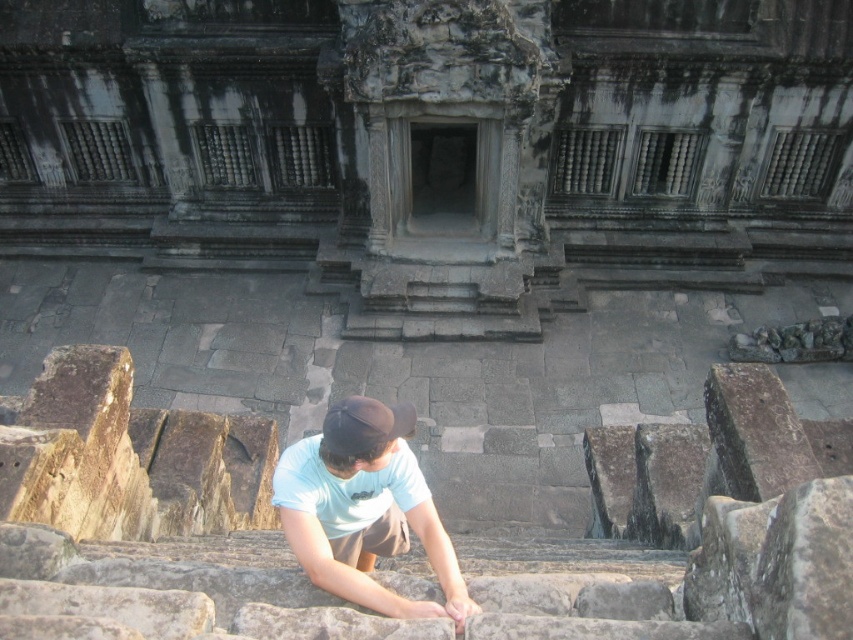
Question: Can you confirm if light blue t-shirt at center is bigger than black fabric baseball cap at center?

Choices:
 (A) no
 (B) yes

Answer: (B)

Question: Is light blue t-shirt at center above black fabric baseball cap at center?

Choices:
 (A) yes
 (B) no

Answer: (B)

Question: Is light blue t-shirt at center positioned in front of black fabric baseball cap at center?

Choices:
 (A) yes
 (B) no

Answer: (A)

Question: Among these points, which one is nearest to the camera?

Choices:
 (A) (386, 445)
 (B) (386, 428)

Answer: (B)